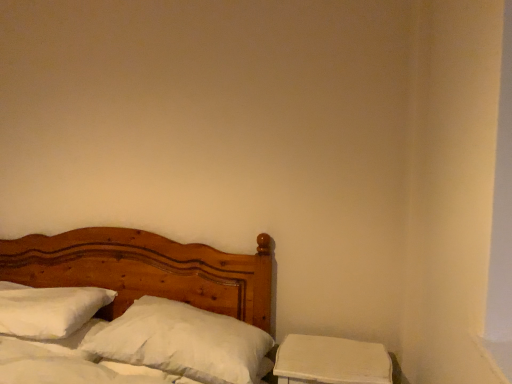
Question: In the image, is white soft pillow at center, which is the 1th pillow in right-to-left order, positioned in front of or behind white soft pillow at left, the second pillow in the right-to-left sequence?

Choices:
 (A) front
 (B) behind

Answer: (A)

Question: Is white soft pillow at center, the 2th pillow from the left, inside the boundaries of white soft pillow at left, acting as the 1th pillow starting from the left, or outside?

Choices:
 (A) outside
 (B) inside

Answer: (A)

Question: Which object is the farthest from the white soft pillow at left, acting as the 1th pillow starting from the left?

Choices:
 (A) white matte nightstand at lower right
 (B) wooden bed at left
 (C) white soft pillow at center, the 2th pillow from the left

Answer: (A)

Question: Estimate the real-world distances between objects in this image. Which object is closer to the white soft pillow at center, the 2th pillow from the left?

Choices:
 (A) white matte nightstand at lower right
 (B) white soft pillow at left, the second pillow in the right-to-left sequence
 (C) wooden bed at left

Answer: (A)